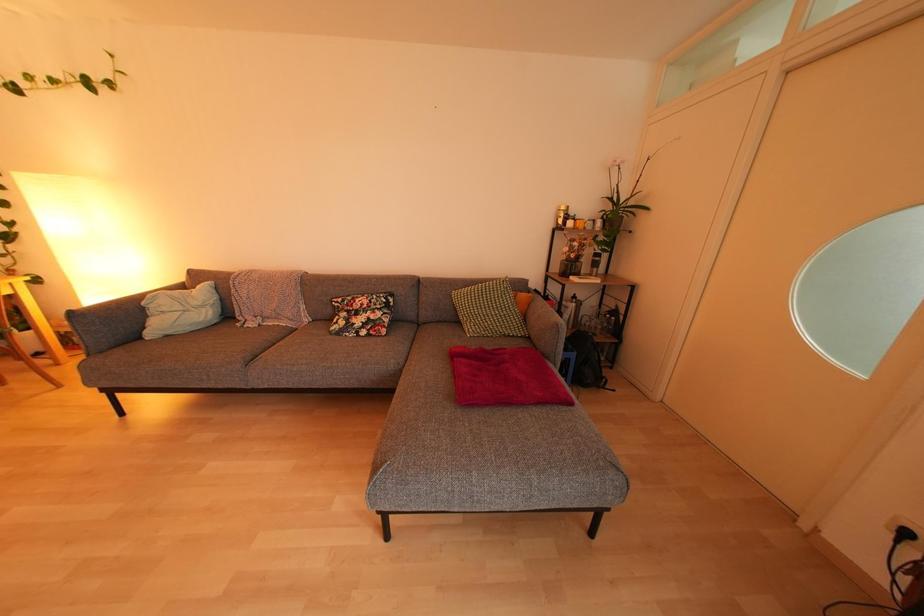
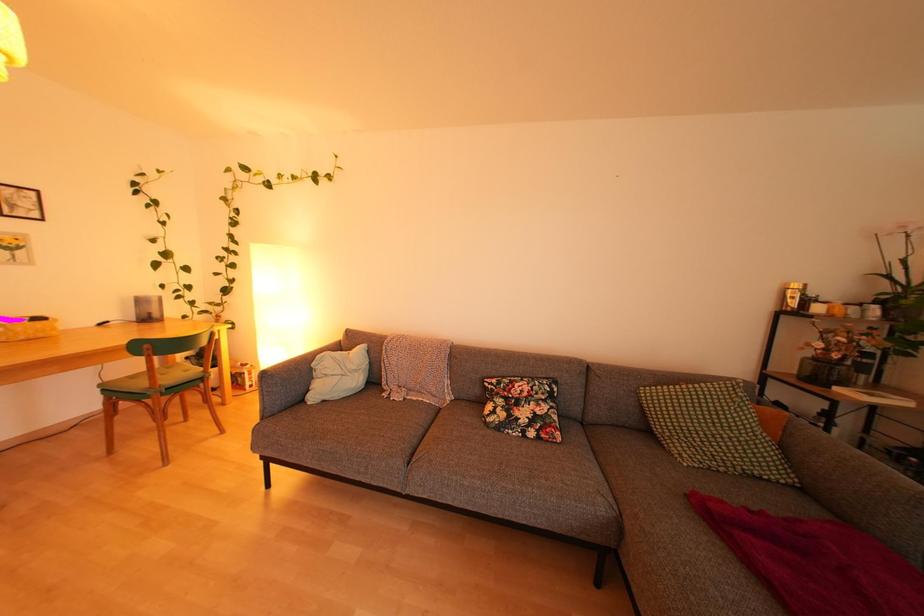
Question: The camera is either moving clockwise (left) or counter-clockwise (right) around the object. The first image is from the beginning of the video and the second image is from the end. Is the camera moving left or right when shooting the video?

Choices:
 (A) Left
 (B) Right

Answer: (B)